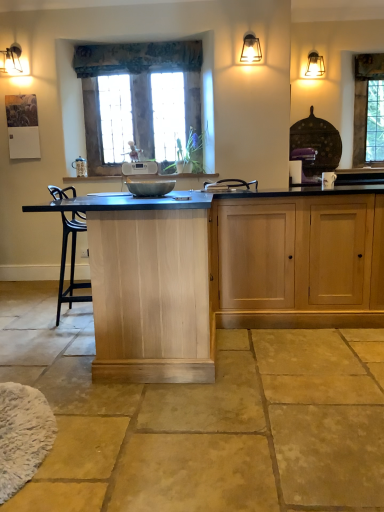
At what (x,y) coordinates should I click in order to perform the action: click on free space that is in between light wood cabinet at center and natural wood cabinet at center. Please return your answer as a coordinate pair (x, y). This screenshot has height=512, width=384. Looking at the image, I should click on (286, 339).